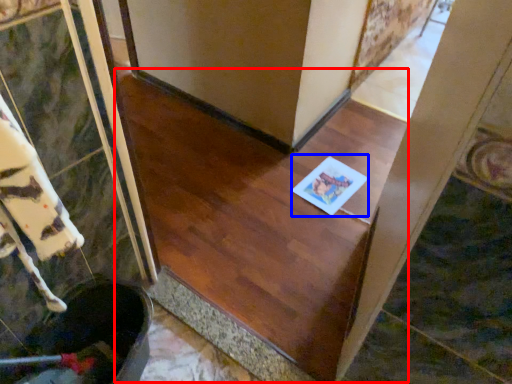
Question: Which point is further to the camera, stairwell (highlighted by a red box) or copy (highlighted by a blue box)?

Choices:
 (A) stairwell
 (B) copy

Answer: (B)